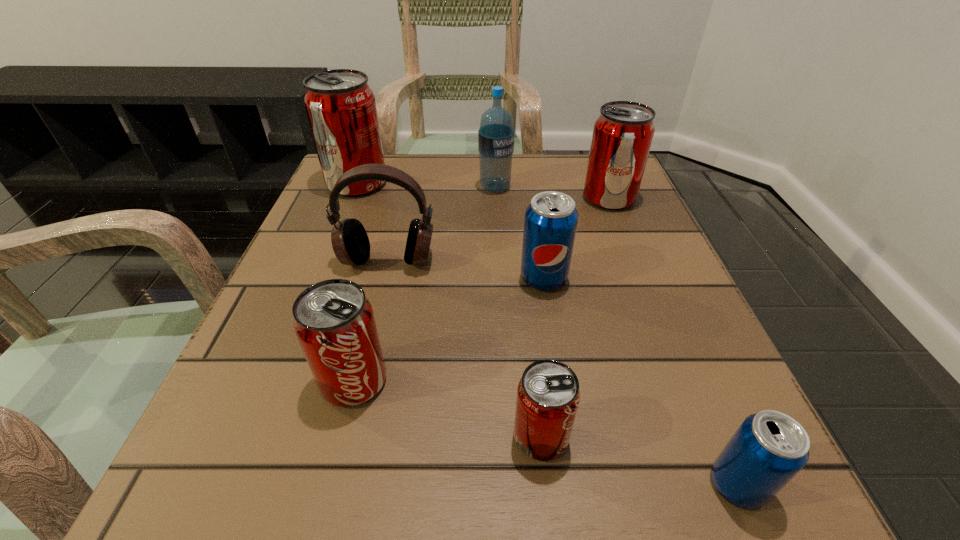
Locate an element on the screen. Image resolution: width=960 pixels, height=540 pixels. vacant space located on the right of the smallest red pop soda is located at coordinates (672, 437).

You are a GUI agent. You are given a task and a screenshot of the screen. Output one action in this format:
    pyautogui.click(x=<x>, y=<y>)
    Task: Click on the water bottle present at the far edge
    
    Given the screenshot: What is the action you would take?
    pyautogui.click(x=496, y=134)

This screenshot has width=960, height=540. What are the coordinates of `headset at the left edge` in the screenshot? It's located at (350, 242).

You are a GUI agent. You are given a task and a screenshot of the screen. Output one action in this format:
    pyautogui.click(x=<x>, y=<y>)
    Task: Click on the object that is at the far left corner
    The image size is (960, 540).
    Given the screenshot: What is the action you would take?
    pyautogui.click(x=340, y=105)

Image resolution: width=960 pixels, height=540 pixels. I want to click on object that is at the far right corner, so click(623, 133).

Image resolution: width=960 pixels, height=540 pixels. Identify the location of object that is positioned at the near right corner. (769, 448).

This screenshot has height=540, width=960. I want to click on free space at the near edge of the desktop, so click(545, 500).

You are a GUI agent. You are given a task and a screenshot of the screen. Output one action in this format:
    pyautogui.click(x=<x>, y=<y>)
    Task: Click on the free region at the left edge
    The height and width of the screenshot is (540, 960).
    Given the screenshot: What is the action you would take?
    pyautogui.click(x=318, y=210)

This screenshot has width=960, height=540. Identify the location of vacant space at the right edge of the desktop. 690,423.

Identify the location of free area in between the smallest red pop soda and the biggest red pop soda. Image resolution: width=960 pixels, height=540 pixels. (449, 310).